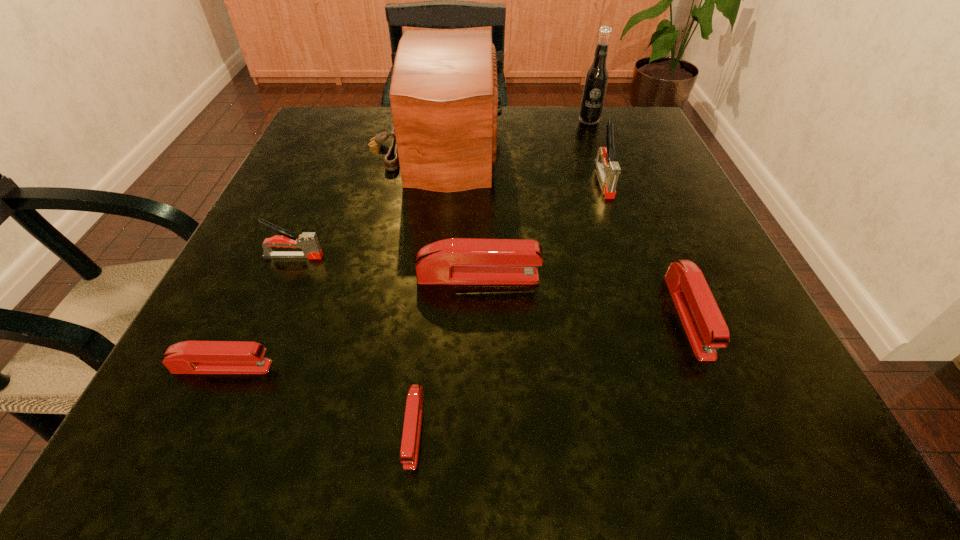
At what (x,y) coordinates should I click in order to perform the action: click on free space at the right edge of the desktop. Please return your answer as a coordinate pair (x, y). Looking at the image, I should click on (614, 232).

Locate an element on the screen. This screenshot has height=540, width=960. free region at the far left corner is located at coordinates (327, 144).

You are a GUI agent. You are given a task and a screenshot of the screen. Output one action in this format:
    pyautogui.click(x=<x>, y=<y>)
    Task: Click on the vacant space at the far right corner of the desktop
    
    Given the screenshot: What is the action you would take?
    pyautogui.click(x=646, y=141)

Find the location of a particular element. free point between the right gray stapler and the biggest red stapler is located at coordinates (540, 228).

The height and width of the screenshot is (540, 960). I want to click on free point between the root beer and the radio receiver, so click(x=513, y=133).

At what (x,y) coordinates should I click in order to perform the action: click on vacant area that lies between the radio receiver and the nearer gray stapler. Please return your answer as a coordinate pair (x, y). This screenshot has width=960, height=540. Looking at the image, I should click on (365, 201).

This screenshot has width=960, height=540. Identify the location of vacant region between the shortest object and the rightmost stapler. (551, 372).

At what (x,y) coordinates should I click in order to perform the action: click on vacant area between the radio receiver and the farthest stapler. Please return your answer as a coordinate pair (x, y). This screenshot has height=540, width=960. Looking at the image, I should click on (519, 163).

In order to click on empty location between the radio receiver and the leftmost red stapler in this screenshot , I will do `click(329, 256)`.

You are a GUI agent. You are given a task and a screenshot of the screen. Output one action in this format:
    pyautogui.click(x=<x>, y=<y>)
    Task: Click on the free spot between the root beer and the farthest stapler
    This screenshot has width=960, height=540.
    Given the screenshot: What is the action you would take?
    pyautogui.click(x=596, y=150)